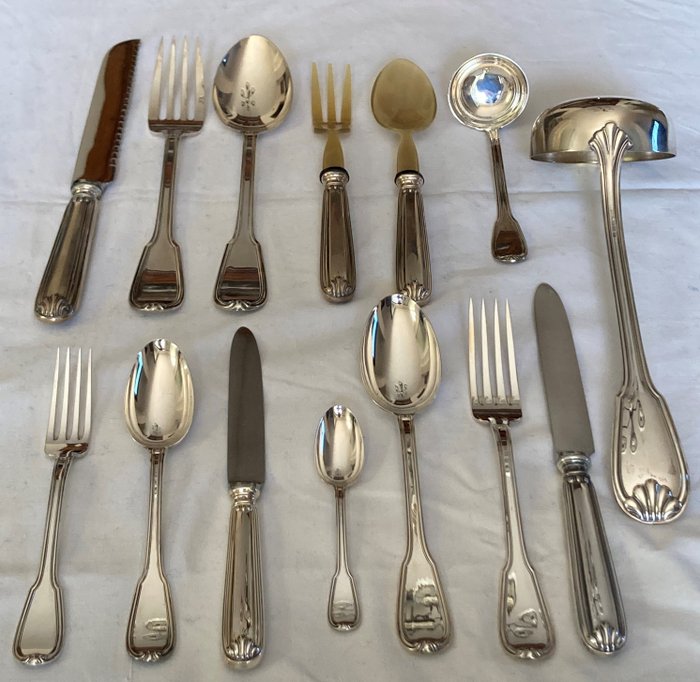
This screenshot has height=682, width=700. I want to click on fork, so click(68, 462), click(178, 133), click(325, 100), click(509, 406).